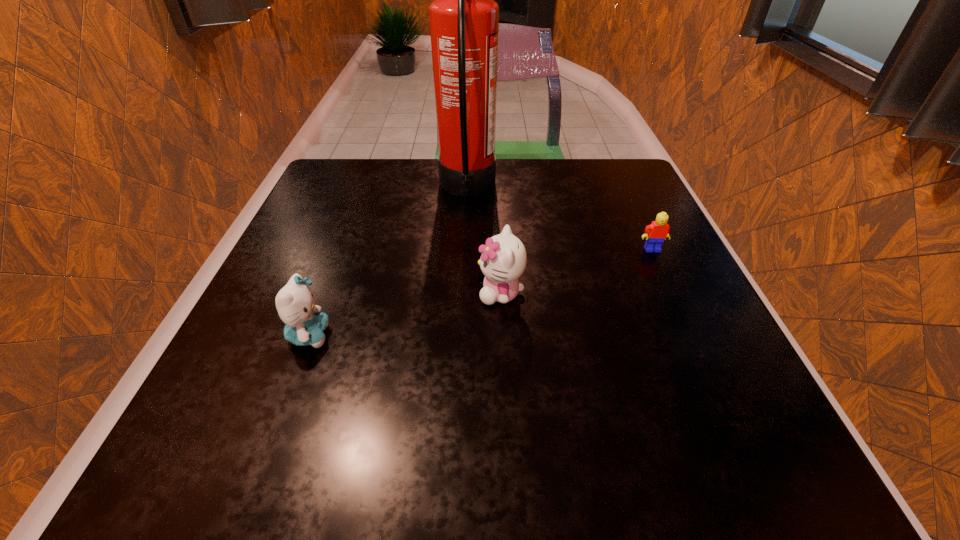
In order to click on the tallest object in this screenshot , I will do `click(464, 18)`.

Find the location of a particular element. The width and height of the screenshot is (960, 540). fire extinguisher is located at coordinates (464, 18).

This screenshot has height=540, width=960. Find the location of `the farther kitten`. the farther kitten is located at coordinates (503, 260).

The image size is (960, 540). I want to click on the right kitten, so click(x=503, y=260).

At what (x,y) coordinates should I click in order to perform the action: click on the left kitten. Please return your answer as a coordinate pair (x, y). This screenshot has height=540, width=960. Looking at the image, I should click on (305, 324).

At what (x,y) coordinates should I click in order to perform the action: click on the second shortest object. Please return your answer as a coordinate pair (x, y). Image resolution: width=960 pixels, height=540 pixels. Looking at the image, I should click on (305, 324).

Identify the location of Lego. The image size is (960, 540). (655, 233).

In order to click on the second farthest object in this screenshot , I will do `click(655, 233)`.

The width and height of the screenshot is (960, 540). What are the coordinates of `vacant space situated 0.140m on the front-facing side of the fire extinguisher` in the screenshot? It's located at (554, 188).

I want to click on vacant position located on the front-facing side of the right kitten, so click(x=345, y=293).